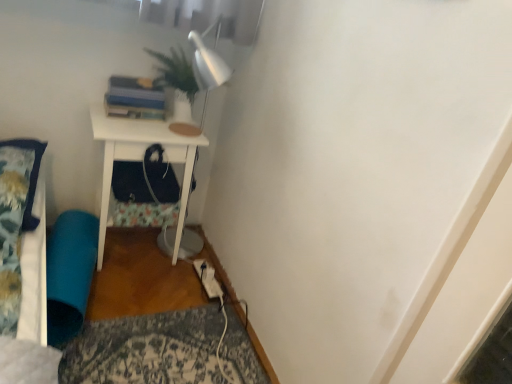
Find the location of a particular element. vacant space underneath white matte nightstand at center (from a real-world perspective) is located at coordinates (121, 253).